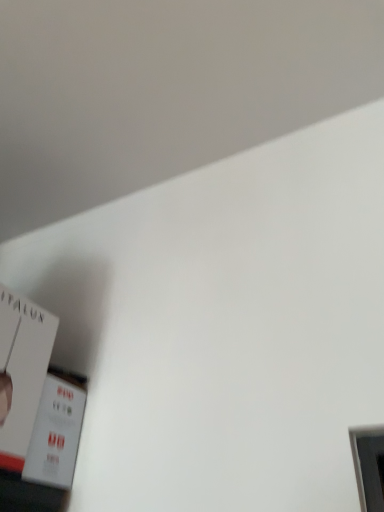
Question: From the image's perspective, is white matte paper at lower left, placed as the second paperback book when sorted from bottom to top, positioned above or below white matte paper at lower left, marked as the first paperback book in a bottom-to-top arrangement?

Choices:
 (A) below
 (B) above

Answer: (B)

Question: Looking at their shapes, would you say white matte paper at lower left, placed as the second paperback book when sorted from bottom to top, is wider or thinner than white matte paper at lower left, the second paperback book positioned from the top?

Choices:
 (A) wide
 (B) thin

Answer: (A)

Question: In terms of size, does white matte paper at lower left, the 1th paperback book in the top-to-bottom sequence, appear bigger or smaller than white matte paper at lower left, marked as the first paperback book in a bottom-to-top arrangement?

Choices:
 (A) small
 (B) big

Answer: (B)

Question: In terms of width, does white matte paper at lower left, the second paperback book positioned from the top, look wider or thinner when compared to white matte paper at lower left, the 1th paperback book in the top-to-bottom sequence?

Choices:
 (A) wide
 (B) thin

Answer: (B)

Question: Does point (33, 476) appear closer or farther from the camera than point (16, 421)?

Choices:
 (A) closer
 (B) farther

Answer: (B)

Question: Is white matte paper at lower left, marked as the first paperback book in a bottom-to-top arrangement, in front of or behind white matte paper at lower left, placed as the second paperback book when sorted from bottom to top, in the image?

Choices:
 (A) front
 (B) behind

Answer: (B)

Question: Based on their sizes in the image, would you say white matte paper at lower left, marked as the first paperback book in a bottom-to-top arrangement, is bigger or smaller than white matte paper at lower left, placed as the second paperback book when sorted from bottom to top?

Choices:
 (A) big
 (B) small

Answer: (B)